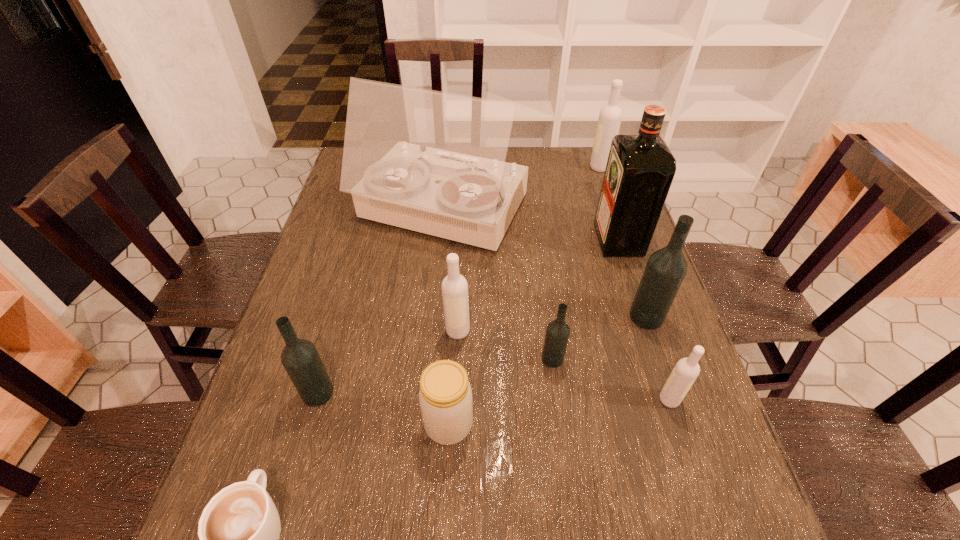
Identify the location of vacant space that is in between the liquor and the white record player. (530, 225).

This screenshot has width=960, height=540. Identify the location of free space between the second nearest white vodka and the biggest white vodka. (529, 249).

The image size is (960, 540). I want to click on empty space between the nearest white vodka and the jar, so click(559, 412).

Select which object appears as the ninth closest to the sixth farthest object. Please provide its 2D coordinates. Your answer should be formatted as a tuple, i.e. [(x, y)], where the tuple contains the x and y coordinates of a point satisfying the conditions above.

[(610, 116)]

This screenshot has width=960, height=540. What are the coordinates of `object that is the fourth closest to the fifth nearest object` in the screenshot? It's located at (685, 372).

Find the location of a particular element. the fourth closest vodka to the fifth vodka from right to left is located at coordinates (685, 372).

Find the location of a particular element. This screenshot has height=540, width=960. vodka object that ranks as the fifth closest to the second farthest black vodka is located at coordinates (610, 116).

Where is `white vodka that is the second nearest to the liquor`? The width and height of the screenshot is (960, 540). white vodka that is the second nearest to the liquor is located at coordinates (685, 372).

Locate which white vodka is the closest to the white record player. Please provide its 2D coordinates. Your answer should be formatted as a tuple, i.e. [(x, y)], where the tuple contains the x and y coordinates of a point satisfying the conditions above.

[(454, 286)]

Image resolution: width=960 pixels, height=540 pixels. I want to click on the second closest black vodka relative to the farthest black vodka, so click(300, 358).